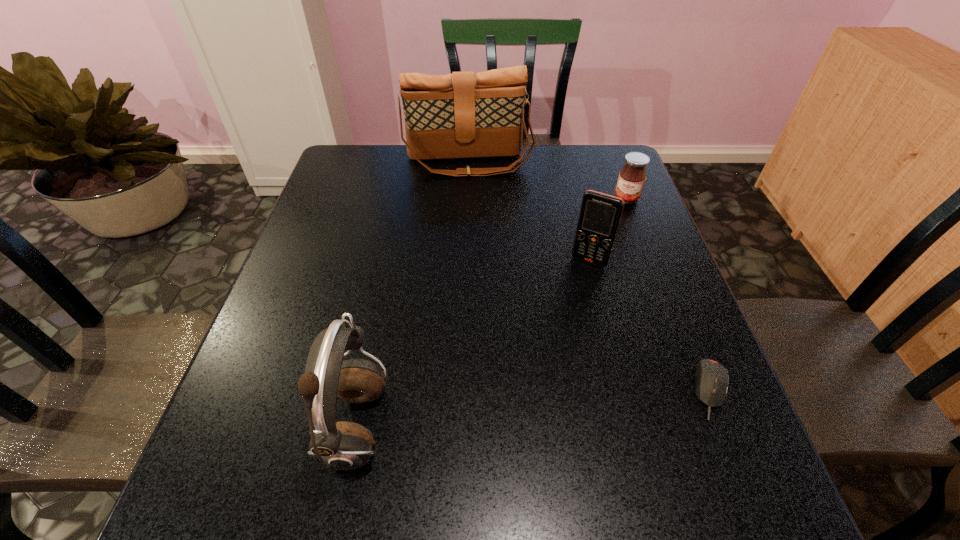
Where is `vacant space in between the third shortest object and the shortest object`? The image size is (960, 540). vacant space in between the third shortest object and the shortest object is located at coordinates 651,326.

I want to click on free spot between the earphone and the third nearest object, so click(x=472, y=345).

You are a GUI agent. You are given a task and a screenshot of the screen. Output one action in this format:
    pyautogui.click(x=<x>, y=<y>)
    Task: Click on the free spot between the shortest object and the third object from left to right
    This screenshot has width=960, height=540.
    Given the screenshot: What is the action you would take?
    pyautogui.click(x=651, y=326)

Locate an element on the screen. The height and width of the screenshot is (540, 960). free space between the shoulder bag and the shortest object is located at coordinates (590, 276).

You are a GUI agent. You are given a task and a screenshot of the screen. Output one action in this format:
    pyautogui.click(x=<x>, y=<y>)
    Task: Click on the vacant space that is in between the farthest object and the earphone
    The width and height of the screenshot is (960, 540).
    Given the screenshot: What is the action you would take?
    pyautogui.click(x=412, y=295)

The height and width of the screenshot is (540, 960). Find the location of `vacant space that is in between the farthest object and the cellular telephone`. vacant space that is in between the farthest object and the cellular telephone is located at coordinates (529, 212).

Where is `vacant area that lies between the jam and the farthest object`? vacant area that lies between the jam and the farthest object is located at coordinates (547, 180).

Find the location of `free space that is in between the third tallest object and the earphone`. free space that is in between the third tallest object and the earphone is located at coordinates (472, 345).

This screenshot has height=540, width=960. Find the location of `free area in between the earphone and the second shortest object`. free area in between the earphone and the second shortest object is located at coordinates (492, 314).

The width and height of the screenshot is (960, 540). Identify the location of object that can be found as the fourth closest to the computer mouse. pyautogui.click(x=460, y=115).